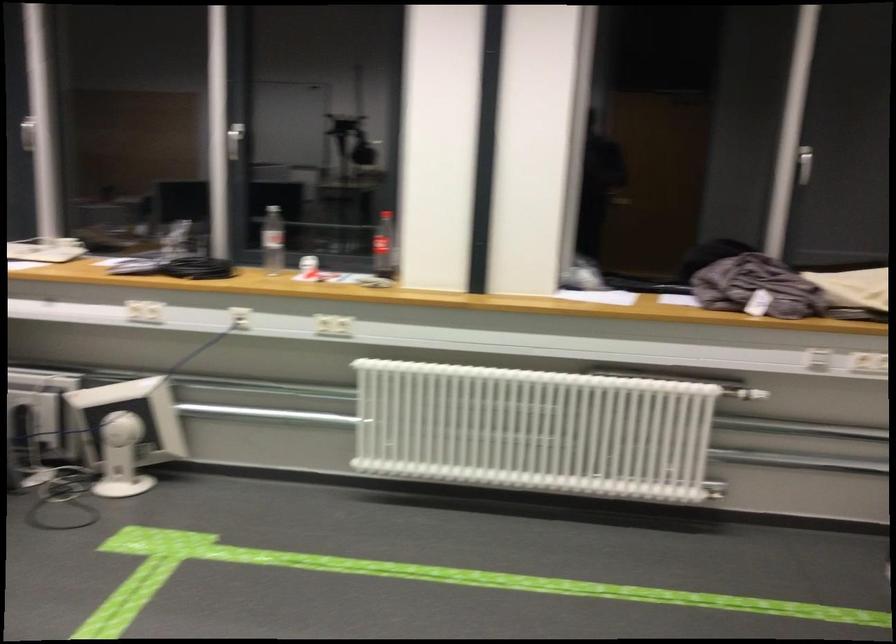
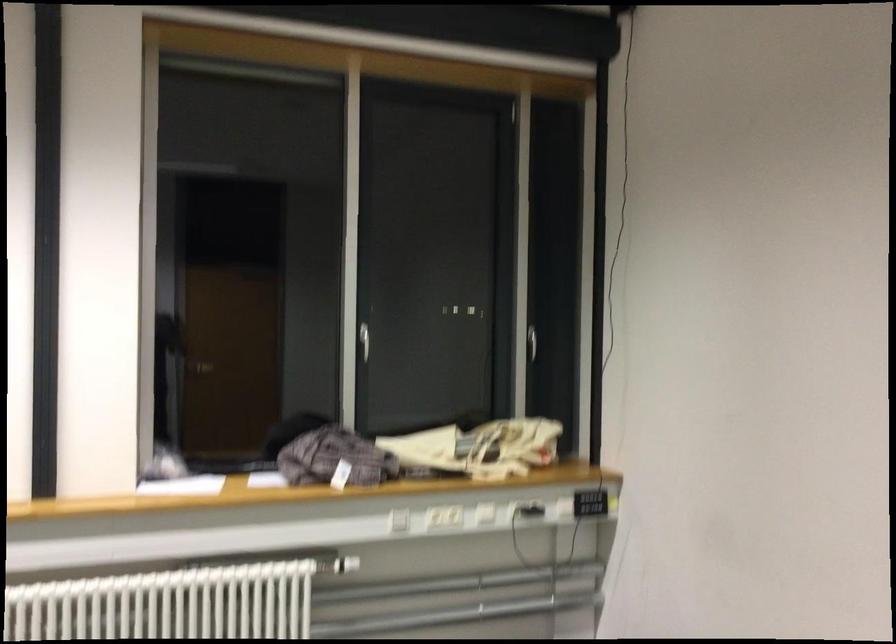
Which direction would the cameraman need to move to produce the second image?

The movement direction of the cameraman is right, backward.